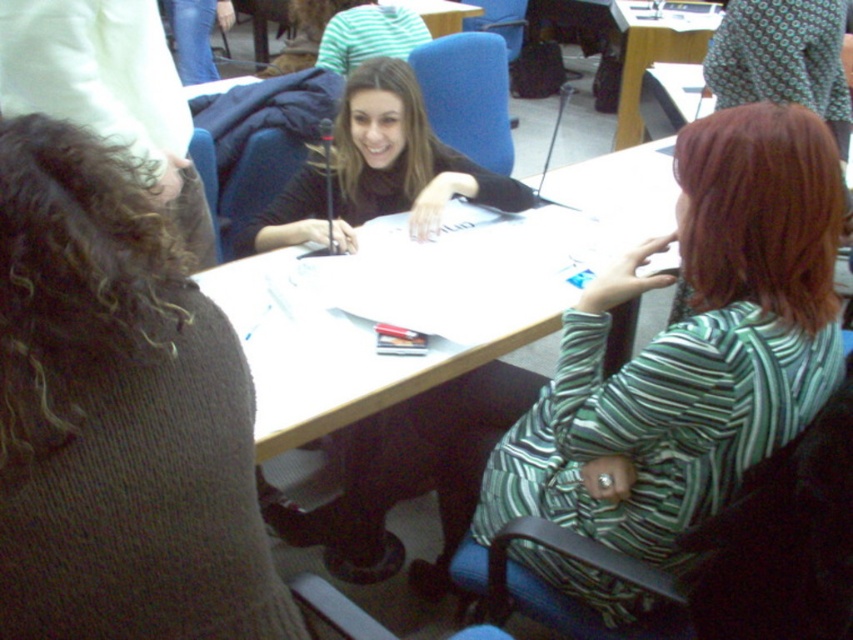
You are organizing a clothing donation drive and need to categorize items by size. You have a knitted brown sweater at left and a matte black shirt at center. Which item should you place in the small size bin?

The knitted brown sweater at left has a smaller size compared to the matte black shirt at center, so it should be placed in the small size bin.

You are sitting at the wooden table at upper center and want to hand a document to the person wearing the green striped shirt at right. Can you reach them directly without moving from your seat?

The green striped shirt at right is in front of the wooden table at upper center, so you can reach them directly without moving from your seat.

In the scene shown: You are a photographer setting up a shoot in this scene. You need to place a small microphone on the table between the knitted brown sweater at left and the matte black shirt at center. Based on their positions, which object should the microphone be closer to?

The knitted brown sweater at left is located above the matte black shirt at center, so the microphone should be placed closer to the knitted brown sweater at left since it is positioned higher up.